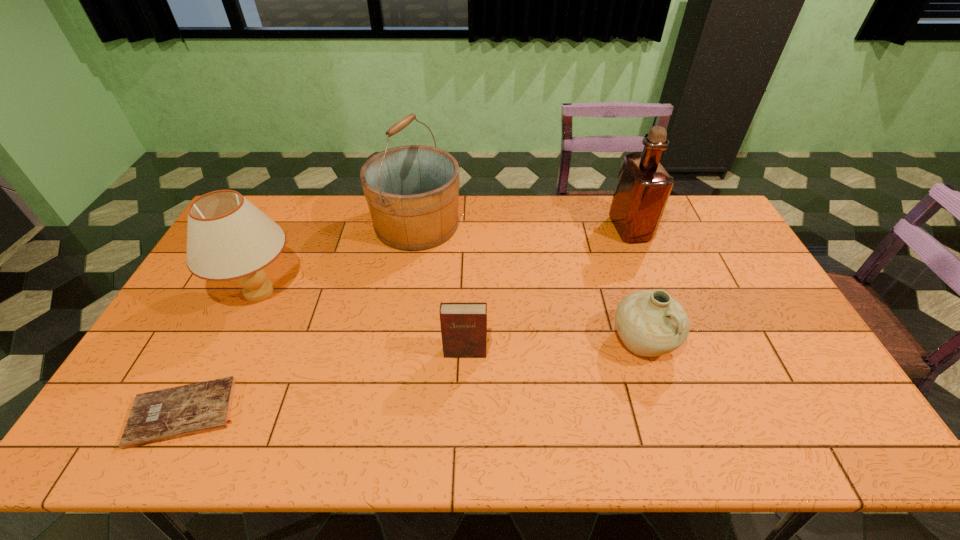
In the image, there is a desktop. At what (x,y) coordinates should I click in order to perform the action: click on blank space at the near edge. Please return your answer as a coordinate pair (x, y). This screenshot has width=960, height=540. Looking at the image, I should click on (319, 441).

Find the location of a particular element. The height and width of the screenshot is (540, 960). free space at the left edge of the desktop is located at coordinates (204, 330).

This screenshot has height=540, width=960. Identify the location of vacant area at the right edge. (713, 266).

At what (x,y) coordinates should I click in order to perform the action: click on free spot at the near right corner of the desktop. Please return your answer as a coordinate pair (x, y). Image resolution: width=960 pixels, height=540 pixels. Looking at the image, I should click on (788, 424).

This screenshot has width=960, height=540. Identify the location of free space between the nearest object and the liquor. click(x=407, y=321).

This screenshot has height=540, width=960. I want to click on free space between the lampshade and the bucket, so click(338, 258).

I want to click on vacant area between the lampshade and the liquor, so click(x=444, y=260).

Identify the location of vacant area that lies between the lampshade and the liquor. (444, 260).

Where is `vacant point located between the nearest object and the diary`? The image size is (960, 540). vacant point located between the nearest object and the diary is located at coordinates (324, 382).

Find the location of a particular element. The image size is (960, 540). empty space that is in between the lampshade and the bucket is located at coordinates (338, 258).